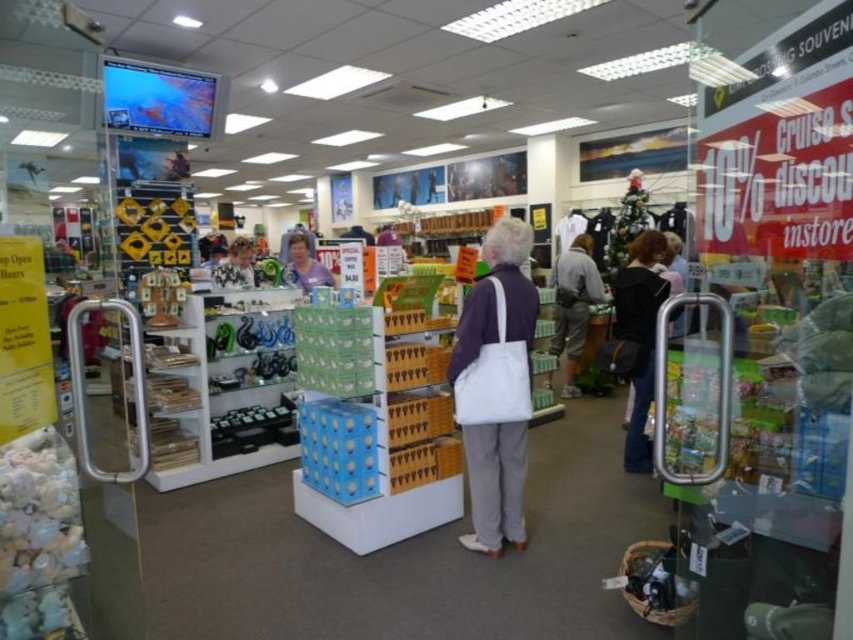
Question: Is white canvas tote bag at center thinner than black fabric purse at center?

Choices:
 (A) yes
 (B) no

Answer: (A)

Question: Observing the image, what is the correct spatial positioning of white canvas tote bag at center in reference to purple fabric shirt at center?

Choices:
 (A) right
 (B) left

Answer: (A)

Question: Which point is closer to the camera?

Choices:
 (A) purple fabric shirt at center
 (B) white canvas tote bag at center

Answer: (B)

Question: Which point appears closest to the camera in this image?

Choices:
 (A) (634, 253)
 (B) (469, 433)
 (C) (595, 276)

Answer: (B)

Question: Which point is closer to the camera taking this photo?

Choices:
 (A) [309, 253]
 (B) [520, 422]
 (C) [637, 241]
 (D) [582, 312]

Answer: (B)

Question: Can you confirm if light gray fabric backpack at center is wider than purple fabric shirt at center?

Choices:
 (A) no
 (B) yes

Answer: (B)